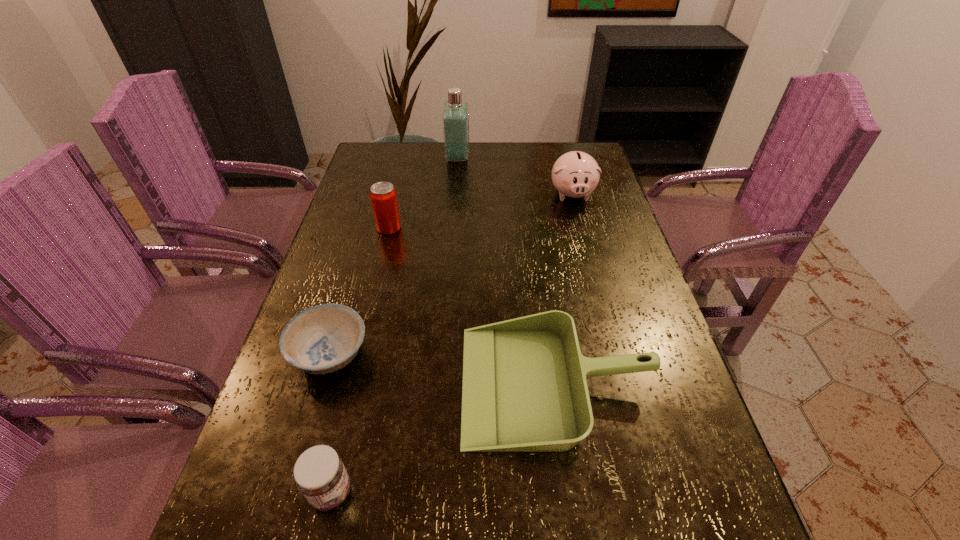
Identify the location of dustpan that is at the right edge. The width and height of the screenshot is (960, 540). [524, 389].

Identify the location of vacant space at the far edge of the desktop. The image size is (960, 540). (515, 148).

Locate an element on the screen. The image size is (960, 540). vacant area at the left edge is located at coordinates (358, 251).

The width and height of the screenshot is (960, 540). Find the location of `vacant region at the right edge of the desktop`. vacant region at the right edge of the desktop is located at coordinates (x=650, y=385).

Locate an element on the screen. Image resolution: width=960 pixels, height=540 pixels. vacant space at the far left corner is located at coordinates (367, 165).

At what (x,y) coordinates should I click in order to perform the action: click on free space between the tallest object and the third farthest object. Please return your answer as a coordinate pair (x, y). Looking at the image, I should click on (423, 193).

Image resolution: width=960 pixels, height=540 pixels. I want to click on blank region between the nearest object and the can, so click(360, 360).

Identify the location of vacant point located between the jam and the can. click(x=360, y=360).

The width and height of the screenshot is (960, 540). Identify the location of free point between the bowl and the jam. (330, 423).

Find the location of a particular element. The width and height of the screenshot is (960, 540). free area in between the tallest object and the bowl is located at coordinates (394, 256).